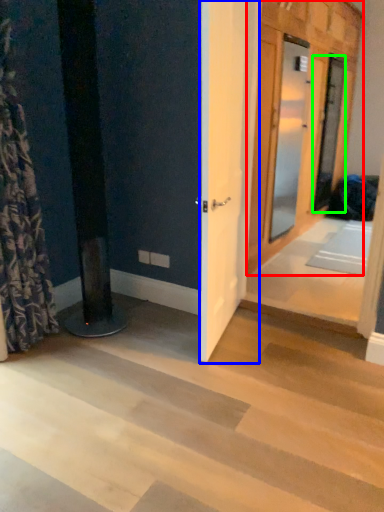
Question: Estimate the real-world distances between objects in this image. Which object is farther from door (highlighted by a red box), barn door (highlighted by a blue box) or door (highlighted by a green box)?

Choices:
 (A) barn door
 (B) door

Answer: (A)